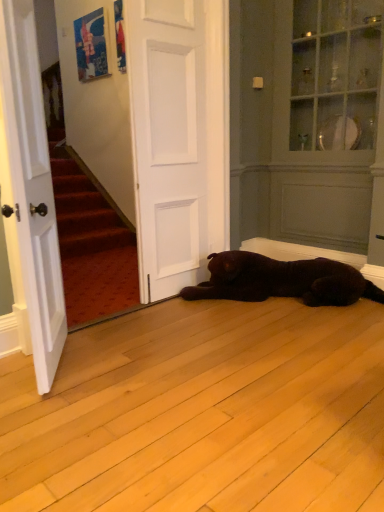
I want to click on white wood door at left, which appears as the 2th door when viewed from the back, so click(x=31, y=187).

Image resolution: width=384 pixels, height=512 pixels. What are the coordinates of `matte white armoire at upper right` in the screenshot? It's located at (306, 120).

Identify the location of white wood door at left, which appears as the first door when viewed from the left. The width and height of the screenshot is (384, 512). (31, 187).

How many degrees apart are the facing directions of white wood door at left, which appears as the 2th door when viewed from the back, and white matte door at center, which is counted as the second door, starting from the front?

There is a 54.1-degree angle between the facing directions of white wood door at left, which appears as the 2th door when viewed from the back, and white matte door at center, which is counted as the second door, starting from the front.

Is white wood door at left, the first door from the front, with white matte door at center, marked as the 2th door in a left-to-right arrangement?

No, white wood door at left, the first door from the front, is not with white matte door at center, marked as the 2th door in a left-to-right arrangement.

Which is more to the left, white wood door at left, which appears as the first door when viewed from the left, or white matte door at center, which is counted as the second door, starting from the front?

From the viewer's perspective, white wood door at left, which appears as the first door when viewed from the left, appears more on the left side.

Does white wood door at left, the first door from the front, have a larger size compared to white matte door at center, which is the 1th door from back to front?

Indeed, white wood door at left, the first door from the front, has a larger size compared to white matte door at center, which is the 1th door from back to front.

Considering their positions, is white matte door at center, which is the 1th door from back to front, located in front of or behind matte white armoire at upper right?

Clearly, white matte door at center, which is the 1th door from back to front, is in front of matte white armoire at upper right.

Would you consider white matte door at center, which is the 1th door from back to front, to be distant from matte white armoire at upper right?

Indeed, white matte door at center, which is the 1th door from back to front, is not near matte white armoire at upper right.

Can you confirm if white matte door at center, which is the 1th door from back to front, is bigger than matte white armoire at upper right?

No, white matte door at center, which is the 1th door from back to front, is not bigger than matte white armoire at upper right.

Considering the relative sizes of white wood door at left, which appears as the 2th door when viewed from the back, and matte white armoire at upper right in the image provided, is white wood door at left, which appears as the 2th door when viewed from the back, bigger than matte white armoire at upper right?

Incorrect, white wood door at left, which appears as the 2th door when viewed from the back, is not larger than matte white armoire at upper right.

Which object is positioned more to the left, white wood door at left, which appears as the 2th door when viewed from the back, or matte white armoire at upper right?

From the viewer's perspective, white wood door at left, which appears as the 2th door when viewed from the back, appears more on the left side.

Would you say matte white armoire at upper right is part of white wood door at left, which appears as the first door when viewed from the left,'s contents?

That's incorrect, matte white armoire at upper right is not inside white wood door at left, which appears as the first door when viewed from the left.

Is white wood door at left, which appears as the first door when viewed from the left, beside matte white armoire at upper right?

There is a gap between white wood door at left, which appears as the first door when viewed from the left, and matte white armoire at upper right.

The image size is (384, 512). I want to click on door behind the white wood door at left, which appears as the first door when viewed from the left, so point(168,142).

Is white matte door at center, marked as the 2th door in a left-to-right arrangement, positioned with its back to white wood door at left, which appears as the first door when viewed from the left?

No.

Considering the sizes of objects white matte door at center, positioned as the 1th door in right-to-left order, and white wood door at left, the first door from the front, in the image provided, who is shorter, white matte door at center, positioned as the 1th door in right-to-left order, or white wood door at left, the first door from the front,?

With less height is white wood door at left, the first door from the front.

From the image's perspective, relative to white wood door at left, which appears as the 2th door when viewed from the back, is white matte door at center, which is the 1th door from back to front, above or below?

white matte door at center, which is the 1th door from back to front, is above white wood door at left, which appears as the 2th door when viewed from the back.

From the image's perspective, is matte white armoire at upper right positioned above or below white matte door at center, which is the 1th door from back to front?

Based on their image positions, matte white armoire at upper right is located above white matte door at center, which is the 1th door from back to front.

Locate an element on the screen. This screenshot has width=384, height=512. door that is the 1st object directly below the matte white armoire at upper right (from a real-world perspective) is located at coordinates (168, 142).

Would you say matte white armoire at upper right is outside white matte door at center, which is counted as the second door, starting from the front?

Yes, matte white armoire at upper right is not within white matte door at center, which is counted as the second door, starting from the front.

Considering the positions of point (274, 92) and point (195, 165), is point (274, 92) closer or farther from the camera than point (195, 165)?

Point (274, 92) is positioned farther from the camera compared to point (195, 165).

Visually, is matte white armoire at upper right positioned to the left or to the right of white wood door at left, the first door from the front?

Based on their positions, matte white armoire at upper right is located to the right of white wood door at left, the first door from the front.

How many degrees apart are the facing directions of matte white armoire at upper right and white wood door at left, the 2th door from the right?

matte white armoire at upper right and white wood door at left, the 2th door from the right, are facing 143 degrees away from each other.

Is matte white armoire at upper right outside of white wood door at left, which appears as the 2th door when viewed from the back?

Yes, matte white armoire at upper right is outside of white wood door at left, which appears as the 2th door when viewed from the back.

Find the location of a particular element. armoire behind the white wood door at left, the 2th door from the right is located at coordinates (306, 120).

Identify the location of door lying behind the white wood door at left, which appears as the 2th door when viewed from the back. The width and height of the screenshot is (384, 512). (168, 142).

Locate an element on the screen. armoire positioned vertically above the white matte door at center, which is counted as the second door, starting from the front (from a real-world perspective) is located at coordinates point(306,120).

Which object lies further to the anchor point white matte door at center, positioned as the 1th door in right-to-left order, matte white armoire at upper right or white wood door at left, which appears as the 2th door when viewed from the back?

The object further to white matte door at center, positioned as the 1th door in right-to-left order, is matte white armoire at upper right.

When comparing their distances from matte white armoire at upper right, does white matte door at center, positioned as the 1th door in right-to-left order, or white wood door at left, which appears as the first door when viewed from the left, seem further?

Among the two, white wood door at left, which appears as the first door when viewed from the left, is located further to matte white armoire at upper right.

Looking at the image, which one is located further to matte white armoire at upper right, white wood door at left, which appears as the first door when viewed from the left, or white matte door at center, which is the 1th door from back to front?

white wood door at left, which appears as the first door when viewed from the left.

Which object lies nearer to the anchor point white wood door at left, the first door from the front, matte white armoire at upper right or white matte door at center, marked as the 2th door in a left-to-right arrangement?

white matte door at center, marked as the 2th door in a left-to-right arrangement, is positioned closer to the anchor white wood door at left, the first door from the front.

Which object lies further to the anchor point white wood door at left, the 2th door from the right, white matte door at center, which is counted as the second door, starting from the front, or matte white armoire at upper right?

The object further to white wood door at left, the 2th door from the right, is matte white armoire at upper right.

When comparing their distances from white matte door at center, which is the 1th door from back to front, does white wood door at left, the first door from the front, or matte white armoire at upper right seem further?

Among the two, matte white armoire at upper right is located further to white matte door at center, which is the 1th door from back to front.

The width and height of the screenshot is (384, 512). Identify the location of door between white wood door at left, the first door from the front, and matte white armoire at upper right from left to right. (168, 142).